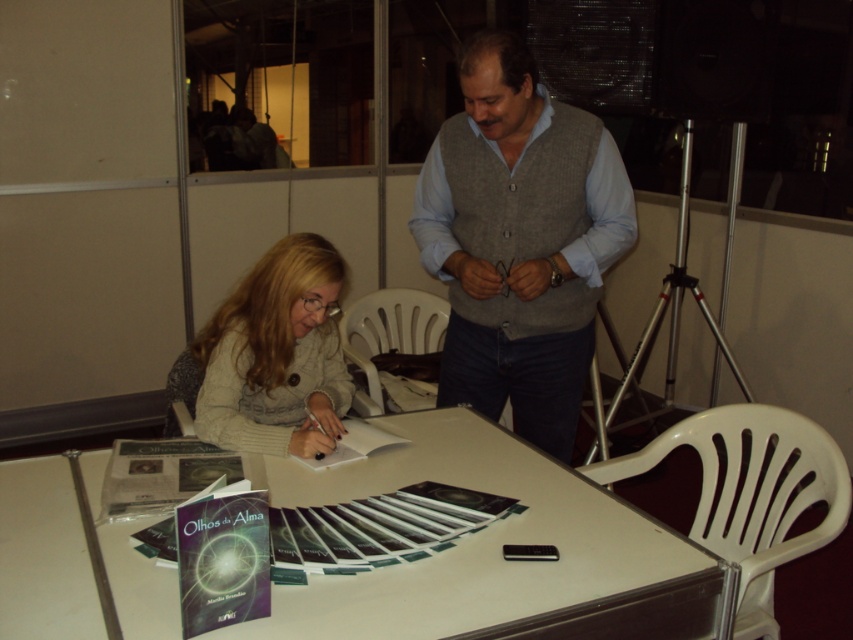
In the scene shown: You are standing at the book signing event looking at the table. There are two points marked on the table. The first point is at coordinates point (485, 276) and the second is at point (225, 342). Which point is closer to you?

Point (225, 342) is closer to you because it is in front of point (485, 276).

What are the coordinates of the white plastic table at center?

The white plastic table at center is located at coordinates point (496, 550).